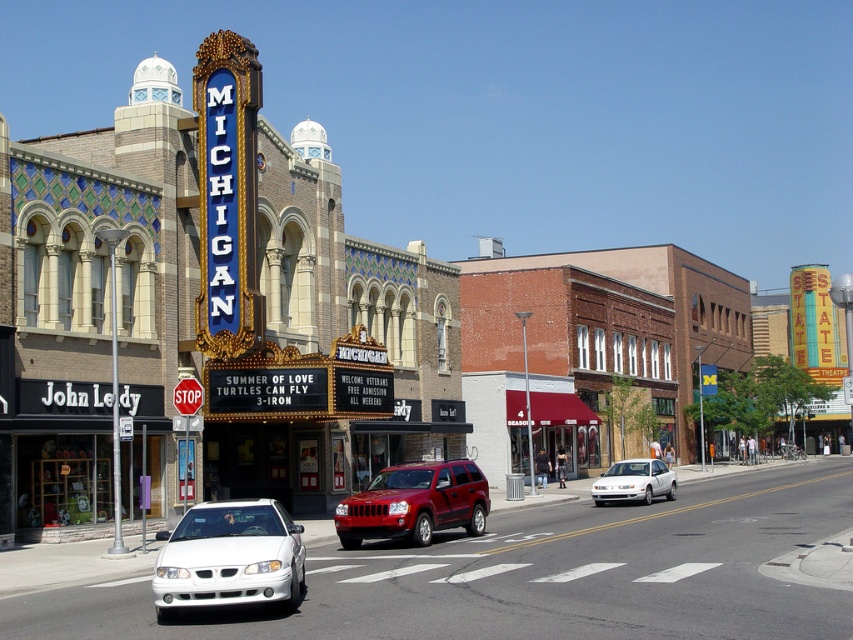
Question: Which object is farther from the camera taking this photo?

Choices:
 (A) white glossy sedan at lower left
 (B) shiny red suv at center
 (C) white matte sedan at center

Answer: (C)

Question: Does white glossy sedan at lower left appear under white matte sedan at center?

Choices:
 (A) yes
 (B) no

Answer: (B)

Question: Considering the real-world distances, which object is farthest from the white matte sedan at center?

Choices:
 (A) shiny red suv at center
 (B) white glossy sedan at lower left

Answer: (B)

Question: Is white glossy sedan at lower left above white matte sedan at center?

Choices:
 (A) yes
 (B) no

Answer: (A)

Question: Which object appears farthest from the camera in this image?

Choices:
 (A) white glossy sedan at lower left
 (B) shiny red suv at center
 (C) white matte sedan at center

Answer: (C)

Question: Does shiny red suv at center have a lesser width compared to white matte sedan at center?

Choices:
 (A) no
 (B) yes

Answer: (B)